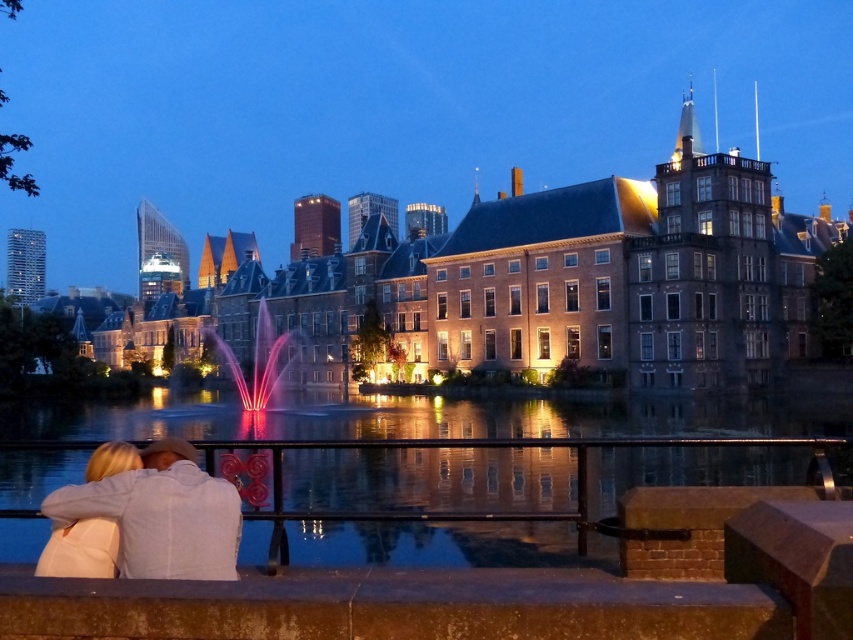
You are standing at the center of the image and want to reach the reflective glass water at lower center. Which direction should you move to reach it?

The reflective glass water at lower center is located at point (x=422, y=417), so you should move towards the lower center direction to reach it.

You are a delivery person carrying a package that requires a 2 meter clearance to avoid damage. You need to walk from the light beige sweater at lower left to the blonde hair at lower left. Can you safely pass through without damaging the package?

The distance between the light beige sweater at lower left and blonde hair at lower left is 1.96 meters. Since the required clearance is 2 meters, the package might be damaged if you pass through this path.